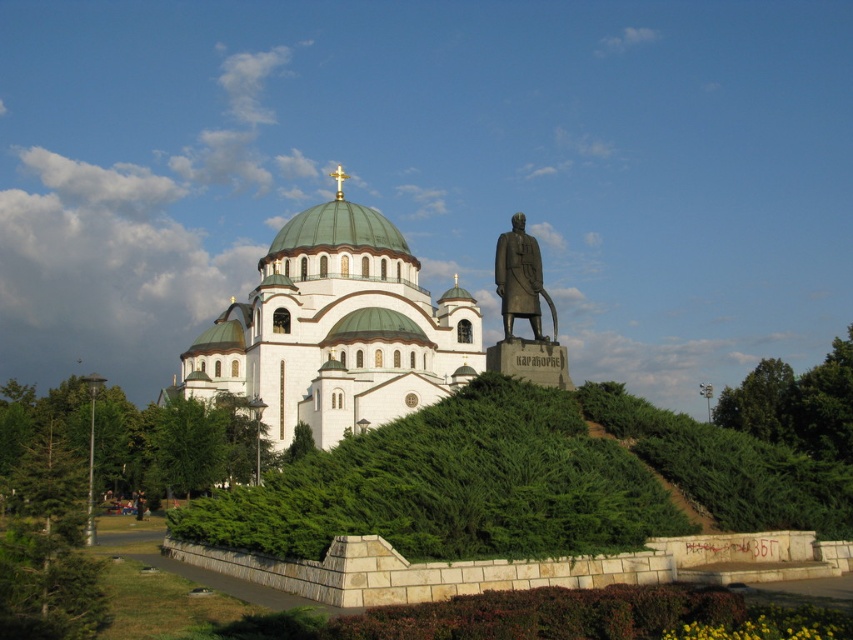
Can you confirm if white stone church at center is wider than bronze statue at right?

Correct, the width of white stone church at center exceeds that of bronze statue at right.

Which is in front, point (351, 372) or point (538, 308)?

Point (538, 308) is in front.

Is point (192, 362) positioned behind point (517, 312)?

Yes, it is behind point (517, 312).

Locate an element on the screen. The height and width of the screenshot is (640, 853). white stone church at center is located at coordinates (335, 332).